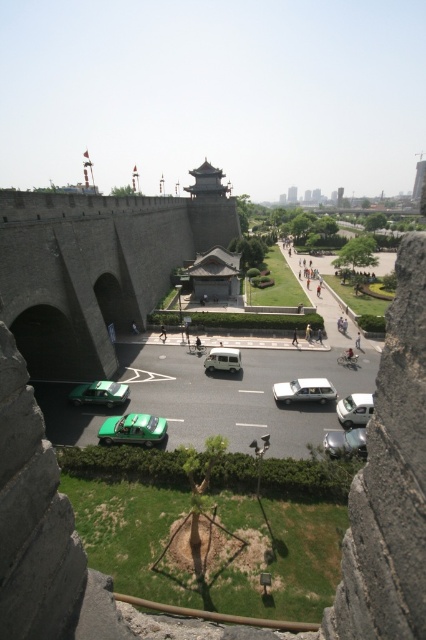
Is silver metallic sedan at center wider than white glossy car at center?

Yes.

Does point (281, 390) lie in front of point (353, 419)?

No, it is behind (353, 419).

At what (x,y) coordinates should I click in order to perform the action: click on silver metallic sedan at center. Please return your answer as a coordinate pair (x, y). The height and width of the screenshot is (640, 426). Looking at the image, I should click on (304, 390).

Can you confirm if stone wall at left is positioned to the right of green matte car at center?

Indeed, stone wall at left is positioned on the right side of green matte car at center.

Can you confirm if stone wall at left is positioned to the left of green matte car at center?

Incorrect, stone wall at left is not on the left side of green matte car at center.

Which is in front, point (97, 234) or point (103, 397)?

Point (103, 397)

This screenshot has width=426, height=640. What are the coordinates of `stone wall at left` in the screenshot? It's located at (97, 266).

The width and height of the screenshot is (426, 640). I want to click on metallic silver car at center, so click(x=345, y=442).

Can you confirm if metallic silver car at center is taller than white matte van at center?

No.

Who is more distant from viewer, (339, 435) or (210, 371)?

The point (210, 371) is behind.

Image resolution: width=426 pixels, height=640 pixels. I want to click on metallic silver car at center, so click(x=345, y=442).